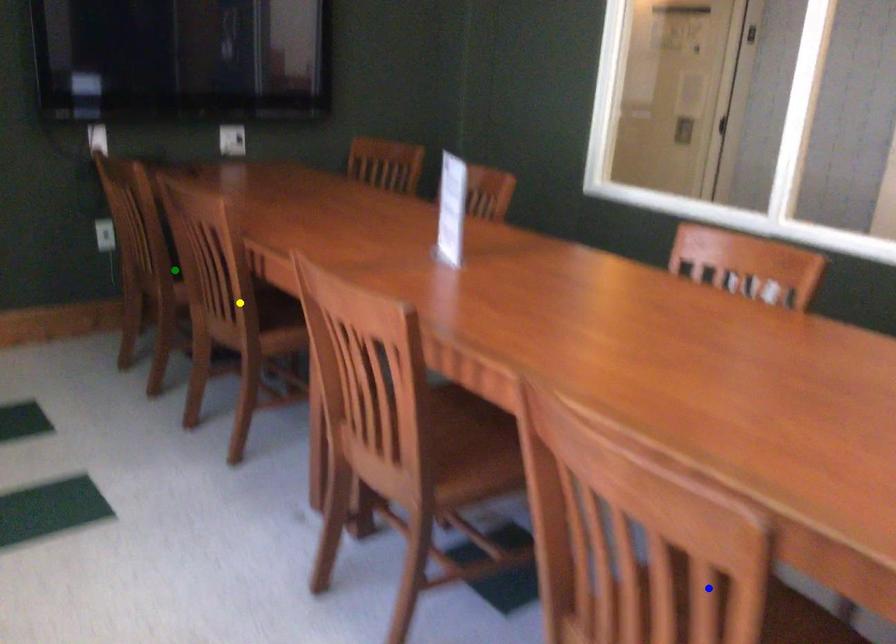
Order these from nearest to farthest:
green point | blue point | yellow point

blue point < yellow point < green point